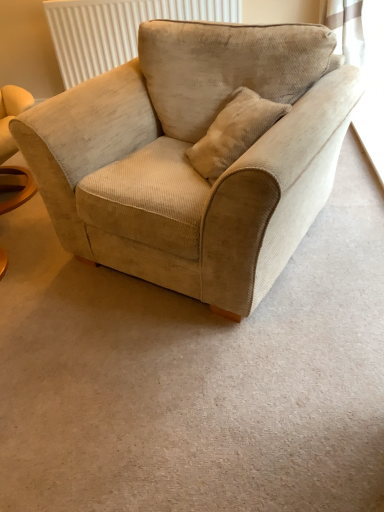
Identify the location of free location in front of beige corduroy armchair at center. This screenshot has width=384, height=512. (199, 382).